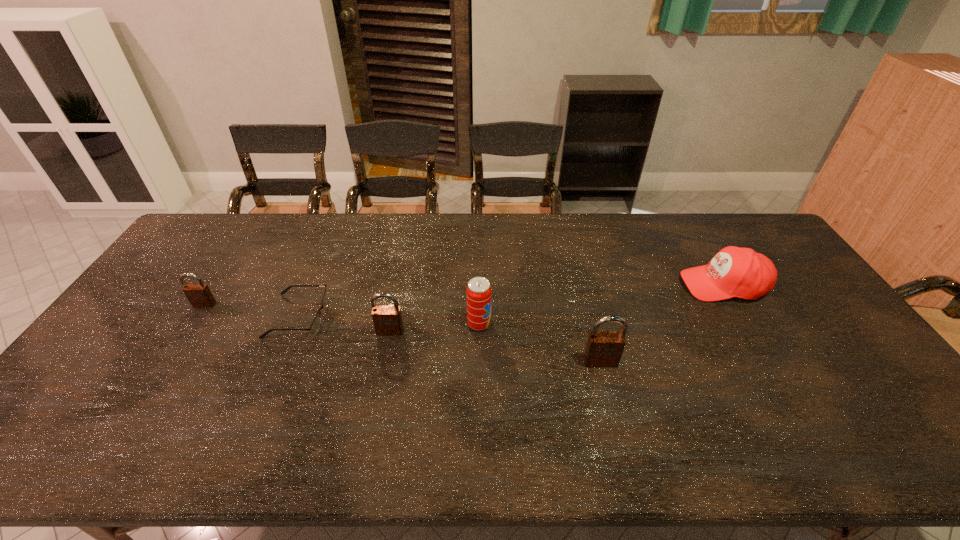
Identify the location of vacant region at the near edge. [x=555, y=392].

This screenshot has height=540, width=960. Identify the location of vacant space at the left edge. (157, 324).

In the image, there is a desktop. Where is `free space at the right edge`? free space at the right edge is located at coordinates (771, 295).

The height and width of the screenshot is (540, 960). What are the coordinates of `free spot between the nearest object and the soda can` in the screenshot? It's located at (540, 343).

You are a GUI agent. You are given a task and a screenshot of the screen. Output one action in this format:
    pyautogui.click(x=<x>, y=<y>)
    Task: Click on the free spot between the nearest padlock and the fourth object from left to right
    This screenshot has height=540, width=960.
    Given the screenshot: What is the action you would take?
    pyautogui.click(x=540, y=343)

The height and width of the screenshot is (540, 960). Identify the location of empty space that is in between the rightmost object and the farthest padlock. (464, 294).

At what (x,y) coordinates should I click in order to perform the action: click on free space that is in between the second padlock from left to right and the baseball cap. Please return your answer as a coordinate pair (x, y). The image size is (960, 540). Looking at the image, I should click on (557, 308).

At what (x,y) coordinates should I click in order to perform the action: click on vacant space in between the second object from right to left and the second tallest padlock. Please return your answer as a coordinate pair (x, y). Looking at the image, I should click on (495, 347).

I want to click on empty space between the spectacles and the baseball cap, so point(511,300).

In order to click on unoccupied area between the soda can and the rightmost padlock in this screenshot , I will do `click(540, 343)`.